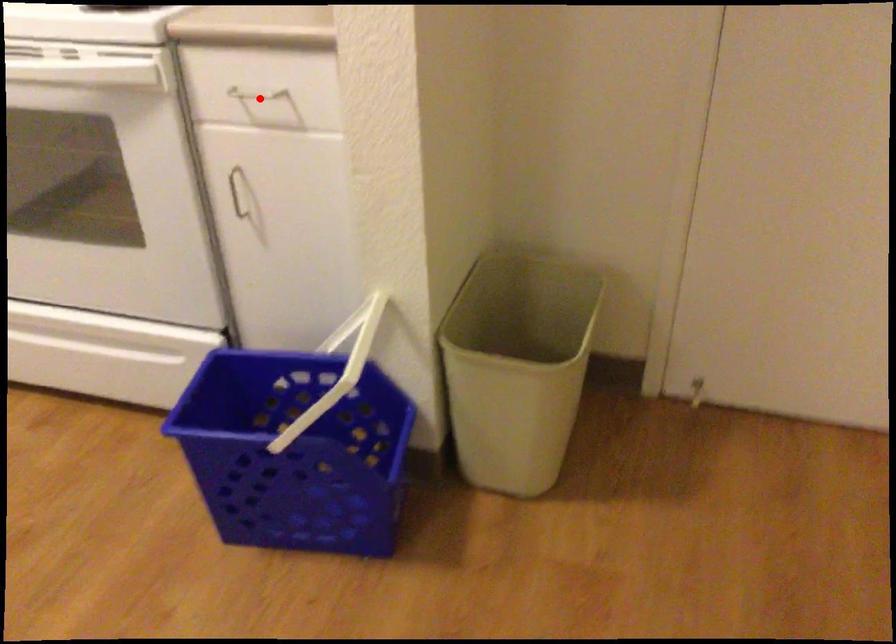
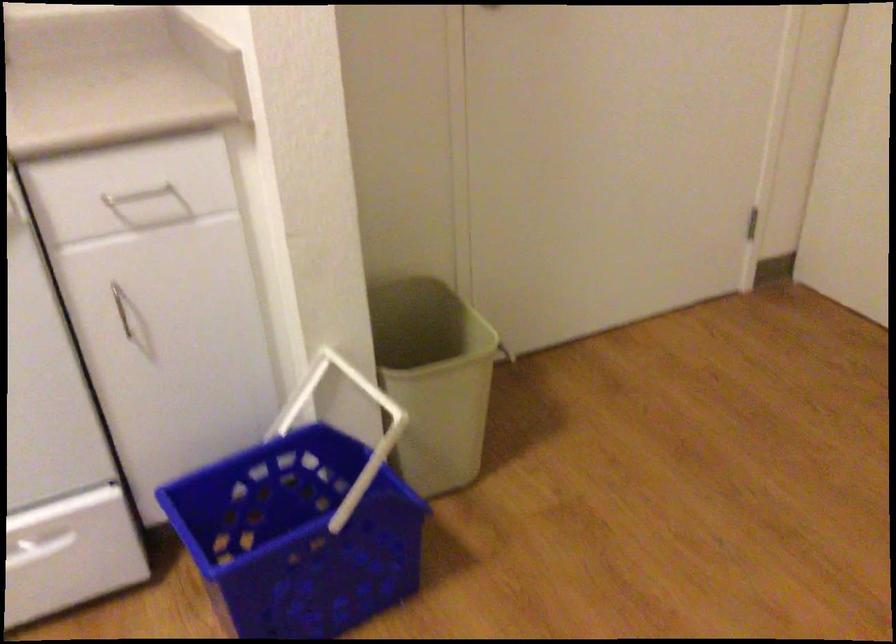
In the second image, find the point that corresponds to the highlighted location in the first image.

(138, 194)